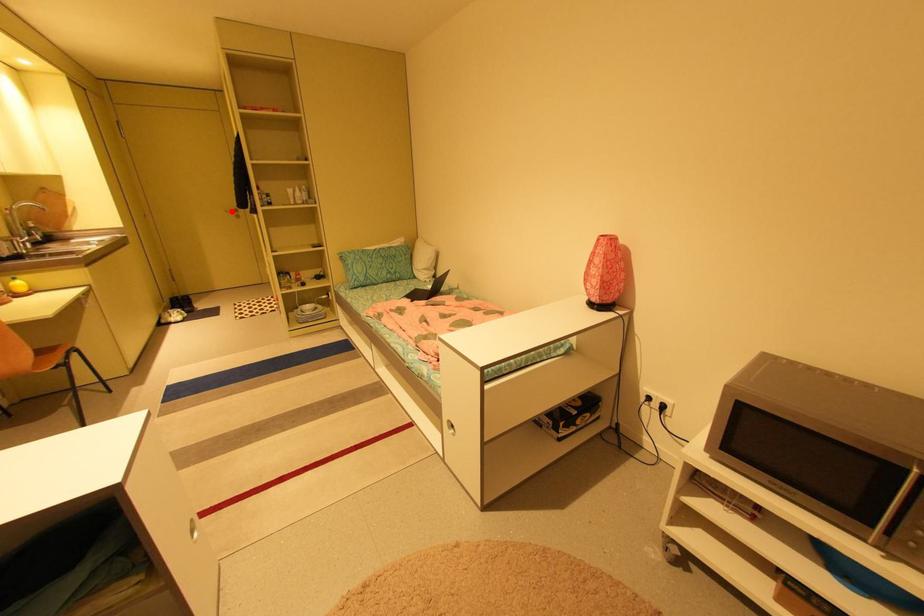
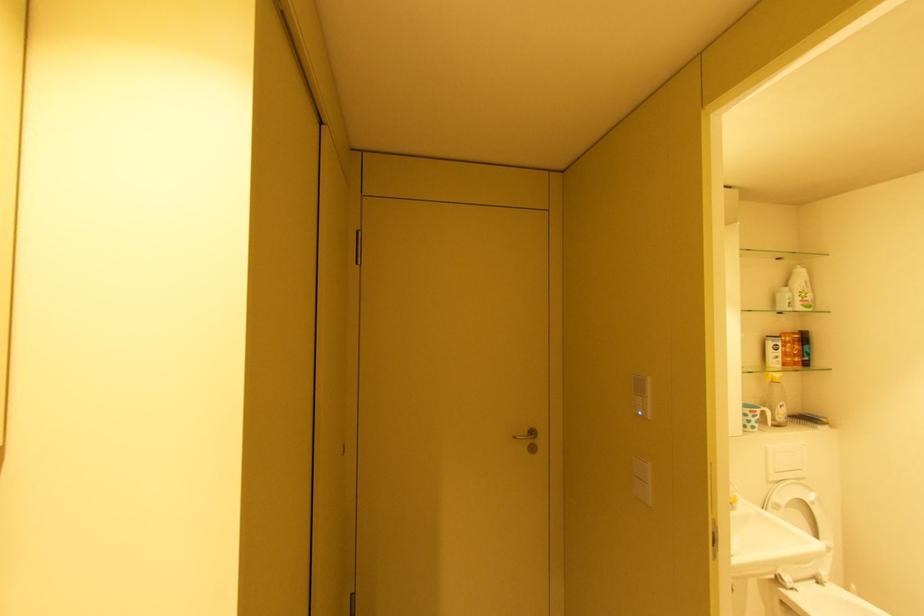
The point at the highlighted location is marked in the first image. Where is the corresponding point in the second image?

(520, 438)